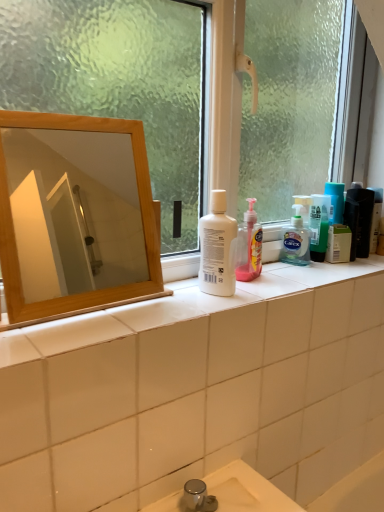
Question: Which is correct: matte black hair care product at right, the second toiletry when ordered from right to left, is inside wooden mirror at upper left, or outside of it?

Choices:
 (A) inside
 (B) outside

Answer: (B)

Question: Considering the relative positions of matte black hair care product at right, acting as the 1th toiletry starting from the left, and wooden mirror at upper left in the image provided, is matte black hair care product at right, acting as the 1th toiletry starting from the left, to the left or to the right of wooden mirror at upper left?

Choices:
 (A) left
 (B) right

Answer: (B)

Question: Based on their relative distances, which object is farther from the white plastic bottle at center?

Choices:
 (A) transparent glass window at center
 (B) matte black hair care product at right, acting as the 1th toiletry starting from the left
 (C) wooden mirror at upper left
 (D) translucent plastic bottle at right, the first toiletry positioned from the right

Answer: (C)

Question: Based on their relative distances, which object is nearer to the transparent glass window at center?

Choices:
 (A) matte black hair care product at right, acting as the 1th toiletry starting from the left
 (B) white plastic bottle at center
 (C) translucent plastic bottle at right, the first toiletry positioned from the right
 (D) wooden mirror at upper left

Answer: (B)